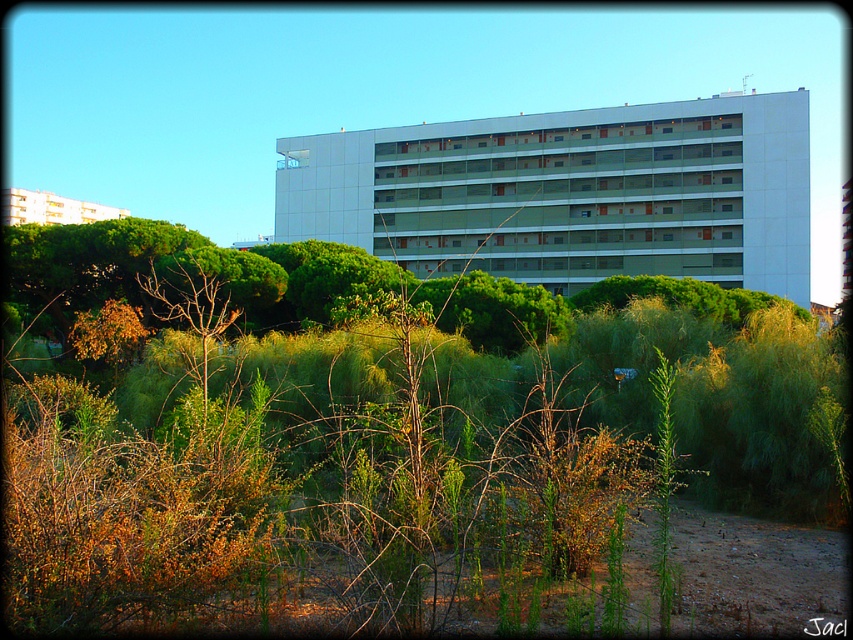
Can you confirm if white smooth building at center is shorter than white glossy building at upper left?

Yes.

Between white smooth building at center and white glossy building at upper left, which one is positioned higher?

white glossy building at upper left is above.

Does point (515, 243) lie in front of point (47, 218)?

Yes, point (515, 243) is in front of point (47, 218).

This screenshot has height=640, width=853. What are the coordinates of `white smooth building at center` in the screenshot? It's located at (570, 193).